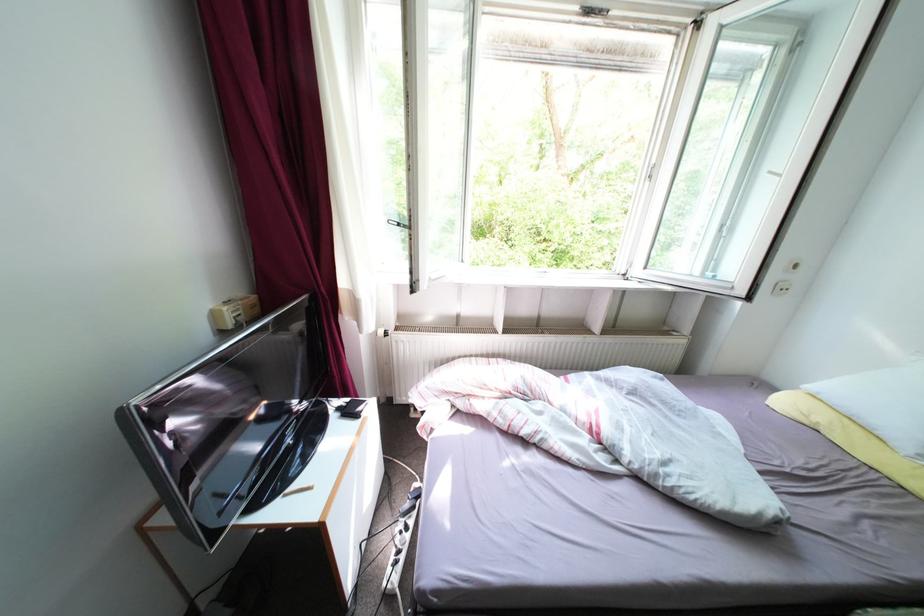
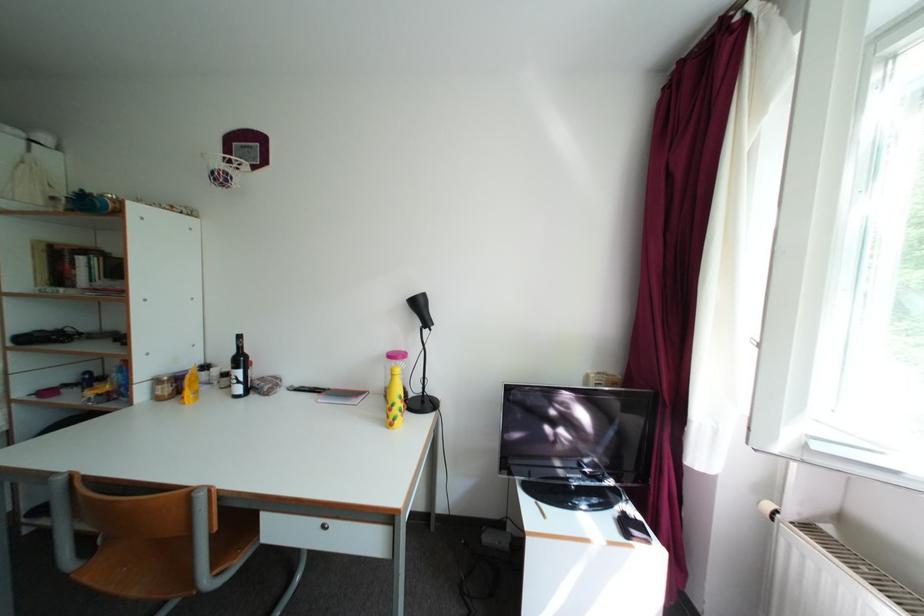
Question: The camera is either moving clockwise (left) or counter-clockwise (right) around the object. The first image is from the beginning of the video and the second image is from the end. Is the camera moving left or right when shooting the video?

Choices:
 (A) Left
 (B) Right

Answer: (B)